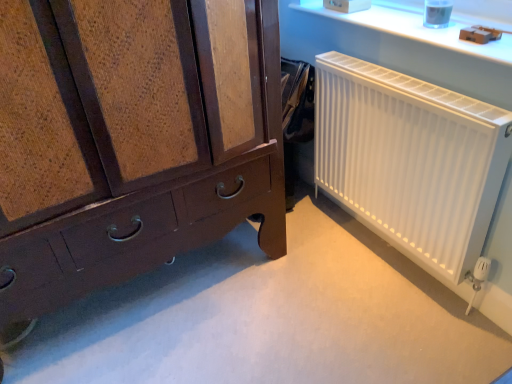
The image size is (512, 384). What do you see at coordinates (132, 139) in the screenshot?
I see `matte brown wooden chest of drawers at lower left` at bounding box center [132, 139].

The image size is (512, 384). In order to click on matte brown wooden chest of drawers at lower left in this screenshot , I will do `click(132, 139)`.

Who is taller, matte brown wooden chest of drawers at lower left or white matte radiator at right?

matte brown wooden chest of drawers at lower left.

In order to click on radiator below the matte brown wooden chest of drawers at lower left (from a real-world perspective) in this screenshot , I will do `click(410, 159)`.

Considering the sizes of objects matte brown wooden chest of drawers at lower left and white matte radiator at right in the image provided, who is bigger, matte brown wooden chest of drawers at lower left or white matte radiator at right?

matte brown wooden chest of drawers at lower left is bigger.

Is white matte radiator at right positioned far away from white plastic radiator at upper right?

No, there isn't a large distance between white matte radiator at right and white plastic radiator at upper right.

Is point (375, 163) farther from viewer compared to point (465, 43)?

Yes, it is behind point (465, 43).

Is white matte radiator at right facing away from white plastic radiator at upper right?

No, white matte radiator at right is not facing the opposite direction of white plastic radiator at upper right.

Is white matte radiator at right bigger than white plastic radiator at upper right?

Correct, white matte radiator at right is larger in size than white plastic radiator at upper right.

How many degrees apart are the facing directions of matte brown wooden chest of drawers at lower left and white plastic radiator at upper right?

They differ by 89.3 degrees in their facing directions.

Is matte brown wooden chest of drawers at lower left beside white plastic radiator at upper right?

There is a gap between matte brown wooden chest of drawers at lower left and white plastic radiator at upper right.

From a real-world perspective, is matte brown wooden chest of drawers at lower left below white plastic radiator at upper right?

Yes.

In the image, is matte brown wooden chest of drawers at lower left on the left side or the right side of white plastic radiator at upper right?

Clearly, matte brown wooden chest of drawers at lower left is on the left of white plastic radiator at upper right in the image.

Considering the sizes of white plastic radiator at upper right and matte brown wooden chest of drawers at lower left in the image, is white plastic radiator at upper right bigger or smaller than matte brown wooden chest of drawers at lower left?

Considering their sizes, white plastic radiator at upper right takes up less space than matte brown wooden chest of drawers at lower left.

Identify the location of the chest of drawers that appears in front of the white plastic radiator at upper right. (x=132, y=139).

Is white plastic radiator at upper right oriented away from matte brown wooden chest of drawers at lower left?

No, matte brown wooden chest of drawers at lower left is not at the back of white plastic radiator at upper right.

From a real-world perspective, between white plastic radiator at upper right and matte brown wooden chest of drawers at lower left, who is vertically lower?

From a 3D spatial view, matte brown wooden chest of drawers at lower left is below.

Considering the relative sizes of white matte radiator at right and matte brown wooden chest of drawers at lower left in the image provided, is white matte radiator at right shorter than matte brown wooden chest of drawers at lower left?

Yes.

In the image, is white matte radiator at right on the left side or the right side of matte brown wooden chest of drawers at lower left?

Clearly, white matte radiator at right is on the right of matte brown wooden chest of drawers at lower left in the image.

Does white plastic radiator at upper right have a larger size compared to white matte radiator at right?

No.

Does point (455, 36) appear closer or farther from the camera than point (486, 122)?

Point (455, 36) is positioned farther from the camera compared to point (486, 122).

Considering the positions of objects white plastic radiator at upper right and white matte radiator at right in the image provided, who is more to the left, white plastic radiator at upper right or white matte radiator at right?

Positioned to the left is white matte radiator at right.

What are the coordinates of `radiator below the matte brown wooden chest of drawers at lower left (from a real-world perspective)` in the screenshot? It's located at (410, 159).

The width and height of the screenshot is (512, 384). In order to click on radiator in front of the white plastic radiator at upper right in this screenshot , I will do `click(410, 159)`.

Looking at the image, which one is located further to matte brown wooden chest of drawers at lower left, white matte radiator at right or white plastic radiator at upper right?

white plastic radiator at upper right is further to matte brown wooden chest of drawers at lower left.

Estimate the real-world distances between objects in this image. Which object is closer to white plastic radiator at upper right, white matte radiator at right or matte brown wooden chest of drawers at lower left?

Based on the image, white matte radiator at right appears to be nearer to white plastic radiator at upper right.

Looking at the image, which one is located closer to white matte radiator at right, white plastic radiator at upper right or matte brown wooden chest of drawers at lower left?

The object closer to white matte radiator at right is white plastic radiator at upper right.

From the image, which object appears to be farther from matte brown wooden chest of drawers at lower left, white plastic radiator at upper right or white matte radiator at right?

white plastic radiator at upper right.

Consider the image. Which object lies further to the anchor point white matte radiator at right, matte brown wooden chest of drawers at lower left or white plastic radiator at upper right?

matte brown wooden chest of drawers at lower left is further to white matte radiator at right.

Based on their spatial positions, is matte brown wooden chest of drawers at lower left or white matte radiator at right further from white plastic radiator at upper right?

matte brown wooden chest of drawers at lower left is positioned further to the anchor white plastic radiator at upper right.

This screenshot has height=384, width=512. Identify the location of radiator between matte brown wooden chest of drawers at lower left and white plastic radiator at upper right in the horizontal direction. (410, 159).